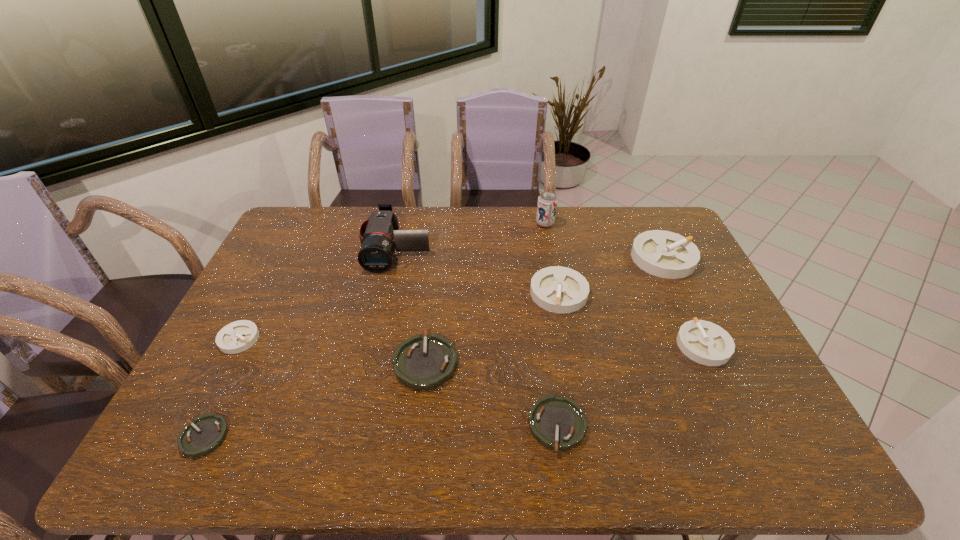
You are a GUI agent. You are given a task and a screenshot of the screen. Output one action in this format:
    pyautogui.click(x=<x>, y=<y>)
    Task: Click on the beer can
    Image resolution: width=960 pixels, height=540 pixels.
    Given the screenshot: What is the action you would take?
    pyautogui.click(x=547, y=201)

Where is `camcorder`? The height and width of the screenshot is (540, 960). camcorder is located at coordinates (379, 235).

Locate an element on the screen. Image resolution: width=960 pixels, height=540 pixels. the tallest ashtray is located at coordinates (665, 254).

Find the location of `the biggest gray ashtray`. the biggest gray ashtray is located at coordinates (665, 254).

Locate an element on the screen. the second tallest ashtray is located at coordinates (557, 289).

What are the coordinates of `the second biggest gray ashtray` in the screenshot? It's located at (557, 289).

The image size is (960, 540). I want to click on the third biggest gray ashtray, so click(x=704, y=342).

Identify the location of the fifth shortest ashtray. The height and width of the screenshot is (540, 960). (704, 342).

I want to click on the second green ashtray from right to left, so click(x=422, y=362).

Locate an element on the screen. the farthest green ashtray is located at coordinates (422, 362).